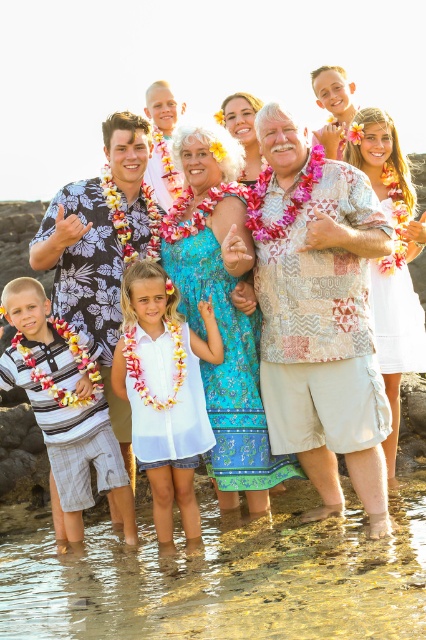
Question: Is clear water at lower center below striped cotton shirt at lower left?

Choices:
 (A) no
 (B) yes

Answer: (B)

Question: Which point is farther from the camera taking this photo?

Choices:
 (A) (34, 364)
 (B) (112, 605)

Answer: (A)

Question: Is white cotton shirt at center positioned before striped cotton shirt at lower left?

Choices:
 (A) yes
 (B) no

Answer: (B)

Question: In this image, where is clear water at lower center located relative to white cotton shirt at center?

Choices:
 (A) left
 (B) right

Answer: (B)

Question: Which object appears closest to the camera in this image?

Choices:
 (A) white cotton shirt at center
 (B) striped cotton shirt at lower left

Answer: (B)

Question: Which object is farther from the camera taking this photo?

Choices:
 (A) clear water at lower center
 (B) white cotton shirt at center

Answer: (B)